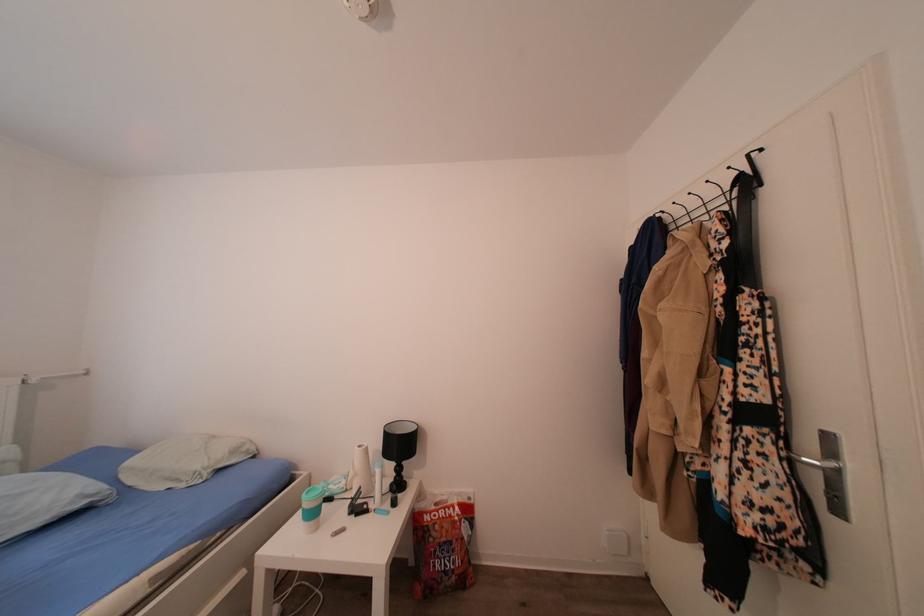
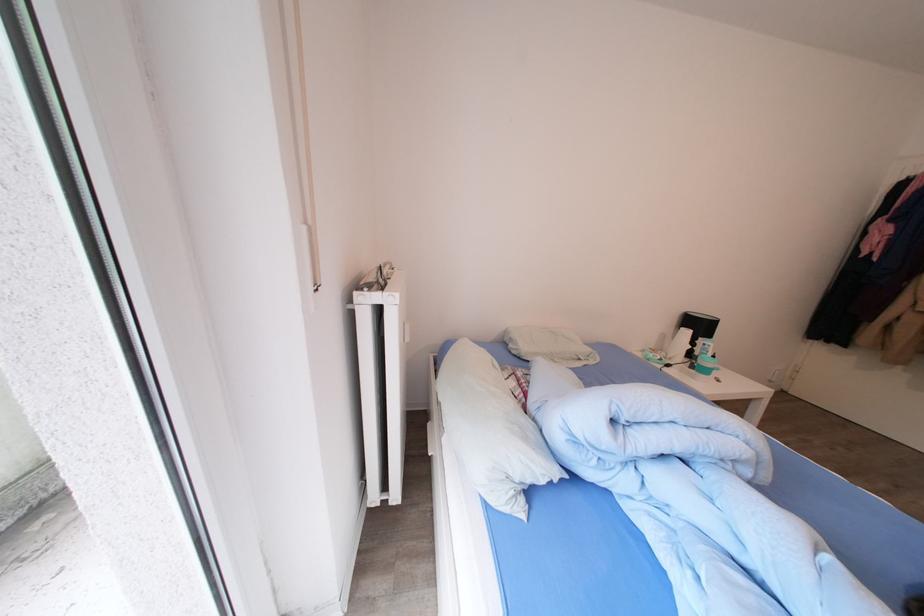
Question: The images are taken continuously from a first-person perspective. In which direction are you moving?

Choices:
 (A) Left
 (B) Right
 (C) Forward
 (D) Backward

Answer: (A)